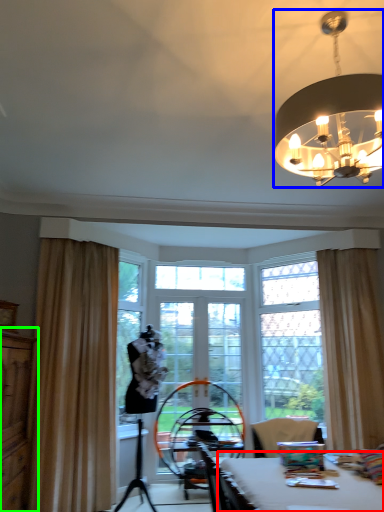
Question: Which object is positioned closest to table (highlighted by a red box)? Select from lamp (highlighted by a blue box) and dresser (highlighted by a green box).

Choices:
 (A) lamp
 (B) dresser

Answer: (A)